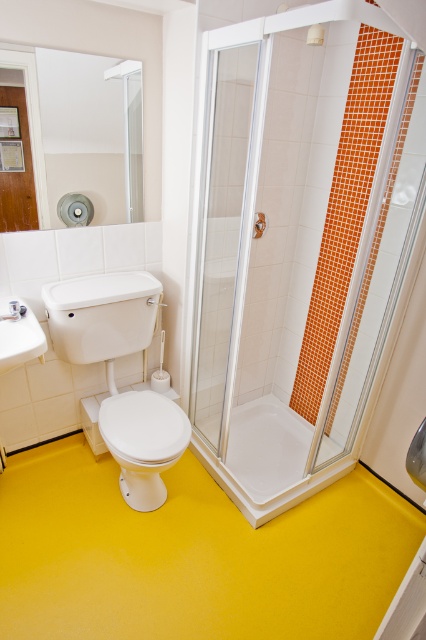
Does clear glass shower door at center appear on the right side of white glossy bathtub at center?

Incorrect, clear glass shower door at center is not on the right side of white glossy bathtub at center.

Is point (238, 280) behind point (322, 470)?

That is False.

This screenshot has width=426, height=640. What do you see at coordinates (222, 227) in the screenshot?
I see `clear glass shower door at center` at bounding box center [222, 227].

At what (x,y) coordinates should I click in order to perform the action: click on clear glass shower door at center. Please return your answer as a coordinate pair (x, y). Image resolution: width=426 pixels, height=640 pixels. Looking at the image, I should click on (222, 227).

Can you confirm if white glossy toilet bowl at lower left is wider than white glossy shower at upper center?

Yes, white glossy toilet bowl at lower left is wider than white glossy shower at upper center.

Between white glossy toilet bowl at lower left and white glossy shower at upper center, which one is positioned lower?

Positioned lower is white glossy toilet bowl at lower left.

Does point (143, 481) lie in front of point (316, 40)?

No, (143, 481) is further to viewer.

Find the location of a particular element. The image size is (426, 640). white glossy toilet bowl at lower left is located at coordinates (143, 442).

How far apart are transparent glass shower door at center and white glossy shower at upper center?

transparent glass shower door at center is 37.78 inches from white glossy shower at upper center.

Is point (249, 51) positioned in front of point (311, 42)?

That is False.

I want to click on transparent glass shower door at center, so click(x=302, y=230).